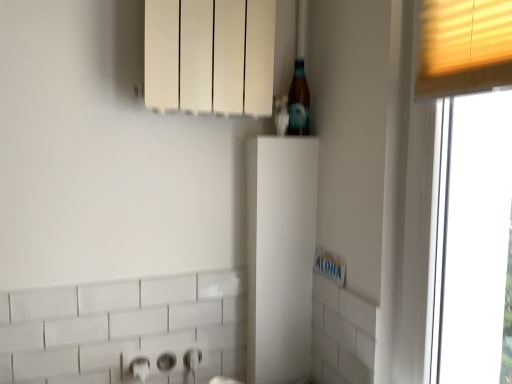
How much space does white matte cabinet at center, the second cabinetry when ordered from top to bottom, occupy horizontally?

The width of white matte cabinet at center, the second cabinetry when ordered from top to bottom, is 3.45 inches.

The height and width of the screenshot is (384, 512). Describe the element at coordinates (210, 56) in the screenshot. I see `white matte radiator at upper center, placed as the second cabinetry when sorted from bottom to top` at that location.

Identify the location of white matte cabinet at center, positioned as the 1th cabinetry in bottom-to-top order. (280, 256).

Would you say white matte radiator at upper center, placed as the second cabinetry when sorted from bottom to top, contains translucent glass bottle at upper right?

Yes.

In the image, is white matte radiator at upper center, placed as the second cabinetry when sorted from bottom to top, positioned in front of or behind translucent glass bottle at upper right?

Visually, white matte radiator at upper center, placed as the second cabinetry when sorted from bottom to top, is located in front of translucent glass bottle at upper right.

Which is further, (254, 25) or (298, 82)?

The point (298, 82) is more distant.

Could you tell me if white matte radiator at upper center, placed as the second cabinetry when sorted from bottom to top, is facing translucent glass bottle at upper right?

No, white matte radiator at upper center, placed as the second cabinetry when sorted from bottom to top, does not turn towards translucent glass bottle at upper right.

Starting from the translucent glass bottle at upper right, which cabinetry is the 2nd one to the left? Please provide its 2D coordinates.

[(210, 56)]

Based on the photo, is white matte radiator at upper center, placed as the second cabinetry when sorted from bottom to top, at the back of translucent glass bottle at upper right?

Absolutely, translucent glass bottle at upper right is directed away from white matte radiator at upper center, placed as the second cabinetry when sorted from bottom to top.

Which is more to the left, translucent glass bottle at upper right or white matte cabinet at center, positioned as the 1th cabinetry in bottom-to-top order?

white matte cabinet at center, positioned as the 1th cabinetry in bottom-to-top order, is more to the left.

The image size is (512, 384). I want to click on cabinetry that is the 1st one when counting forward from the translucent glass bottle at upper right, so click(x=280, y=256).

Which is less distant, (301, 103) or (298, 372)?

The point (301, 103) is in front.

Based on their positions, is white matte cabinet at center, the second cabinetry when ordered from top to bottom, located to the left or right of white matte radiator at upper center, placed as the second cabinetry when sorted from bottom to top?

white matte cabinet at center, the second cabinetry when ordered from top to bottom, is to the right of white matte radiator at upper center, placed as the second cabinetry when sorted from bottom to top.

Measure the distance between white matte cabinet at center, the second cabinetry when ordered from top to bottom, and white matte radiator at upper center, marked as the 1th cabinetry in a top-to-bottom arrangement.

white matte cabinet at center, the second cabinetry when ordered from top to bottom, is 12.81 inches away from white matte radiator at upper center, marked as the 1th cabinetry in a top-to-bottom arrangement.

From the image's perspective, which is below, white matte cabinet at center, the second cabinetry when ordered from top to bottom, or white matte radiator at upper center, placed as the second cabinetry when sorted from bottom to top?

white matte cabinet at center, the second cabinetry when ordered from top to bottom.

Where is `cabinetry that is in front of the white matte cabinet at center, the second cabinetry when ordered from top to bottom`? This screenshot has height=384, width=512. cabinetry that is in front of the white matte cabinet at center, the second cabinetry when ordered from top to bottom is located at coordinates (210, 56).

Considering the sizes of white matte cabinet at center, positioned as the 1th cabinetry in bottom-to-top order, and translucent glass bottle at upper right in the image, is white matte cabinet at center, positioned as the 1th cabinetry in bottom-to-top order, bigger or smaller than translucent glass bottle at upper right?

Clearly, white matte cabinet at center, positioned as the 1th cabinetry in bottom-to-top order, is larger in size than translucent glass bottle at upper right.

Does point (274, 248) appear closer or farther from the camera than point (307, 120)?

Point (274, 248) is farther from the camera than point (307, 120).

I want to click on cabinetry below the translucent glass bottle at upper right (from a real-world perspective), so click(280, 256).

Is white matte cabinet at center, the second cabinetry when ordered from top to bottom, wider than translucent glass bottle at upper right?

Indeed, white matte cabinet at center, the second cabinetry when ordered from top to bottom, has a greater width compared to translucent glass bottle at upper right.

Between white matte radiator at upper center, marked as the 1th cabinetry in a top-to-bottom arrangement, and white matte cabinet at center, positioned as the 1th cabinetry in bottom-to-top order, which one has larger width?

Wider between the two is white matte radiator at upper center, marked as the 1th cabinetry in a top-to-bottom arrangement.

Where is `cabinetry on the right of white matte radiator at upper center, placed as the second cabinetry when sorted from bottom to top`? cabinetry on the right of white matte radiator at upper center, placed as the second cabinetry when sorted from bottom to top is located at coordinates (280, 256).

From the image's perspective, would you say white matte radiator at upper center, placed as the second cabinetry when sorted from bottom to top, is shown under white matte cabinet at center, the second cabinetry when ordered from top to bottom?

No, from the image's perspective, white matte radiator at upper center, placed as the second cabinetry when sorted from bottom to top, is not beneath white matte cabinet at center, the second cabinetry when ordered from top to bottom.

Is white matte radiator at upper center, marked as the 1th cabinetry in a top-to-bottom arrangement, positioned with its back to white matte cabinet at center, the second cabinetry when ordered from top to bottom?

No.

Where is `beer bottle below the white matte radiator at upper center, placed as the second cabinetry when sorted from bottom to top (from the image's perspective)`? This screenshot has height=384, width=512. beer bottle below the white matte radiator at upper center, placed as the second cabinetry when sorted from bottom to top (from the image's perspective) is located at coordinates (298, 101).

Where is `beer bottle beneath the white matte radiator at upper center, marked as the 1th cabinetry in a top-to-bottom arrangement (from a real-world perspective)`? The image size is (512, 384). beer bottle beneath the white matte radiator at upper center, marked as the 1th cabinetry in a top-to-bottom arrangement (from a real-world perspective) is located at coordinates (298, 101).

In the scene shown: When comparing their distances from translucent glass bottle at upper right, does white matte radiator at upper center, placed as the second cabinetry when sorted from bottom to top, or white matte cabinet at center, the second cabinetry when ordered from top to bottom, seem further?

Based on the image, white matte cabinet at center, the second cabinetry when ordered from top to bottom, appears to be further to translucent glass bottle at upper right.

Considering their positions, is white matte radiator at upper center, marked as the 1th cabinetry in a top-to-bottom arrangement, positioned further to white matte cabinet at center, the second cabinetry when ordered from top to bottom, than translucent glass bottle at upper right?

The object further to white matte cabinet at center, the second cabinetry when ordered from top to bottom, is white matte radiator at upper center, marked as the 1th cabinetry in a top-to-bottom arrangement.

Looking at the image, which one is located further to white matte radiator at upper center, marked as the 1th cabinetry in a top-to-bottom arrangement, white matte cabinet at center, the second cabinetry when ordered from top to bottom, or translucent glass bottle at upper right?

white matte cabinet at center, the second cabinetry when ordered from top to bottom, is positioned further to the anchor white matte radiator at upper center, marked as the 1th cabinetry in a top-to-bottom arrangement.

Considering their positions, is white matte cabinet at center, positioned as the 1th cabinetry in bottom-to-top order, positioned further to translucent glass bottle at upper right than white matte radiator at upper center, marked as the 1th cabinetry in a top-to-bottom arrangement?

white matte cabinet at center, positioned as the 1th cabinetry in bottom-to-top order, is further to translucent glass bottle at upper right.

Estimate the real-world distances between objects in this image. Which object is further from white matte cabinet at center, positioned as the 1th cabinetry in bottom-to-top order, translucent glass bottle at upper right or white matte radiator at upper center, marked as the 1th cabinetry in a top-to-bottom arrangement?

Based on the image, white matte radiator at upper center, marked as the 1th cabinetry in a top-to-bottom arrangement, appears to be further to white matte cabinet at center, positioned as the 1th cabinetry in bottom-to-top order.

Estimate the real-world distances between objects in this image. Which object is closer to white matte radiator at upper center, placed as the second cabinetry when sorted from bottom to top, translucent glass bottle at upper right or white matte cabinet at center, the second cabinetry when ordered from top to bottom?

Among the two, translucent glass bottle at upper right is located nearer to white matte radiator at upper center, placed as the second cabinetry when sorted from bottom to top.

This screenshot has height=384, width=512. I want to click on beer bottle between white matte radiator at upper center, marked as the 1th cabinetry in a top-to-bottom arrangement, and white matte cabinet at center, the second cabinetry when ordered from top to bottom, from top to bottom, so click(298, 101).